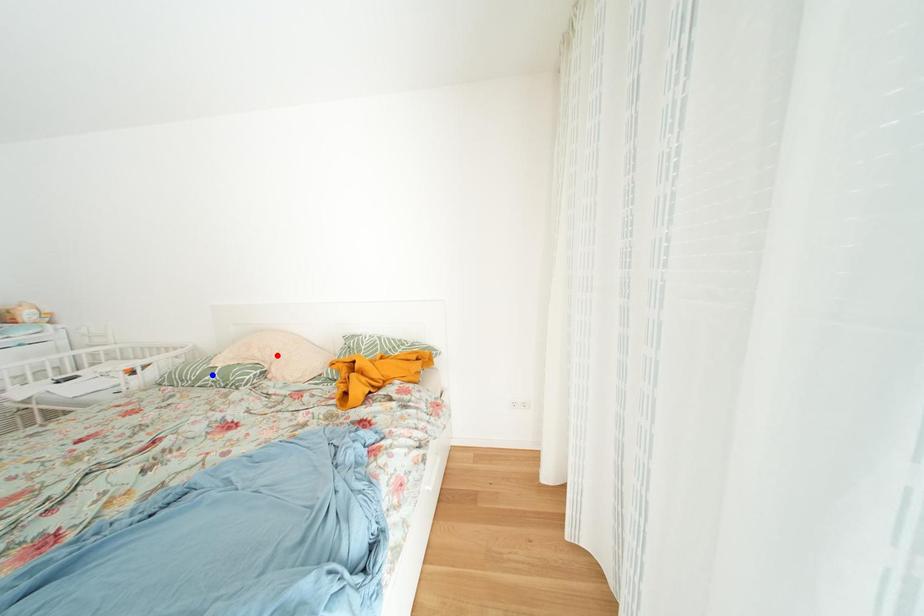
Question: In the image, two points are highlighted. Which point is nearer to the camera? Reply with the corresponding letter.

Choices:
 (A) blue point
 (B) red point

Answer: (A)